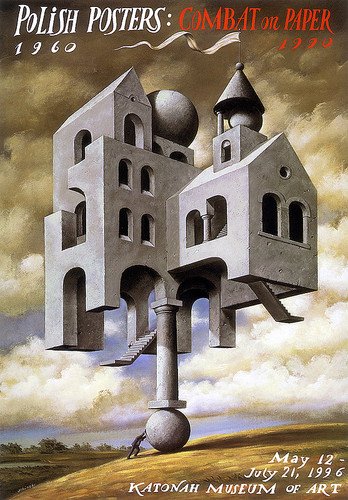
Where is `staircase`? The width and height of the screenshot is (348, 500). staircase is located at coordinates (144, 338), (275, 299), (223, 229).